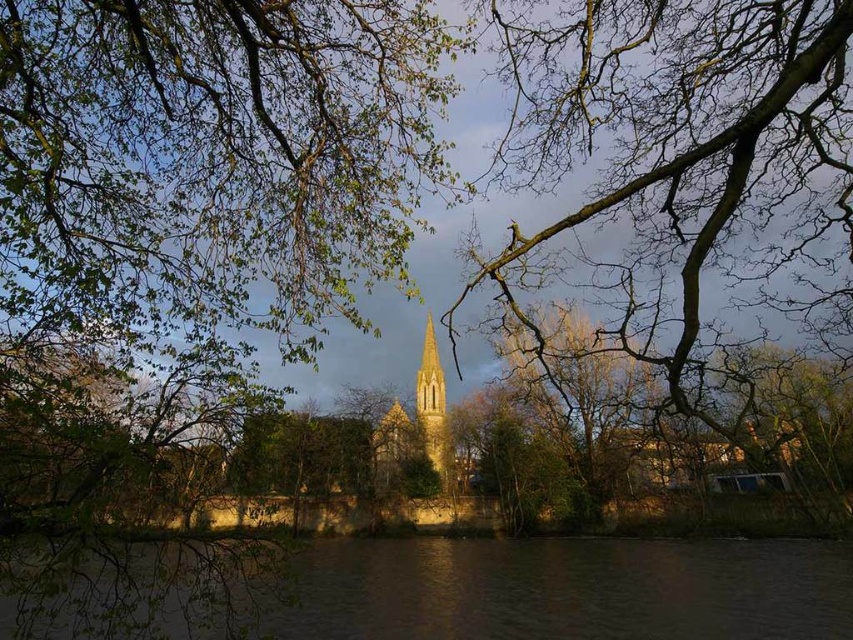
Does point (570, 554) come behind point (444, 376)?

No, (570, 554) is closer to viewer.

Who is more distant from viewer, (469, 564) or (439, 468)?

The point (439, 468) is behind.

What do you see at coordinates (564, 589) in the screenshot?
I see `brown water at lower center` at bounding box center [564, 589].

You are a GUI agent. You are given a task and a screenshot of the screen. Output one action in this format:
    pyautogui.click(x=<x>, y=<y>)
    Task: Click on the brown water at lower center
    
    Given the screenshot: What is the action you would take?
    pyautogui.click(x=564, y=589)

Is bare branches at center taller than golden stone church steeple at center?

In fact, bare branches at center may be shorter than golden stone church steeple at center.

Is bare branches at center closer to camera compared to golden stone church steeple at center?

Yes, bare branches at center is closer to the viewer.

Does point (548, 109) come in front of point (432, 401)?

Yes, it is.

The width and height of the screenshot is (853, 640). What are the coordinates of `bare branches at center` in the screenshot? It's located at (675, 145).

What do you see at coordinates (416, 420) in the screenshot?
I see `golden stone church steeple at center` at bounding box center [416, 420].

Who is shorter, golden stone church steeple at center or golden stone church tower at center?

golden stone church steeple at center is shorter.

Measure the distance between point (x=421, y=392) and camera.

Point (x=421, y=392) and camera are 424.28 feet apart from each other.

Where is `golden stone church steeple at center`? The image size is (853, 640). golden stone church steeple at center is located at coordinates (416, 420).